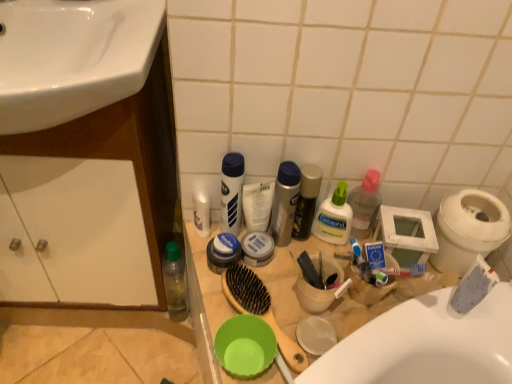
What do you see at coordinates (375, 255) in the screenshot?
I see `blue matte toothpaste at center, which is the first toothpaste from back to front` at bounding box center [375, 255].

Identify the location of brown wooden brush at center. (260, 309).

What do you see at coordinates (334, 217) in the screenshot? The height and width of the screenshot is (384, 512). I see `white pump bottle at center, which appears as the second toiletry when viewed from the right` at bounding box center [334, 217].

In order to face white matte toothpaste at right, positioned as the second toothpaste in back-to-front order, should I rotate leftwards or rightwards?

It's best to rotate right around 26.807 degrees.

Identify the location of green plastic bottle at lower left. (175, 282).

Find the location of a particular element. The width and height of the screenshot is (512, 384). white plastic canister at center, the sixth toiletry in the right-to-left sequence is located at coordinates click(232, 192).

What do you see at coordinates (364, 203) in the screenshot? The height and width of the screenshot is (384, 512). I see `translucent plastic bottle at center right, which ranks as the eighth toiletry in left-to-right order` at bounding box center [364, 203].

Locate an element on the screen. The height and width of the screenshot is (384, 512). blue matte toothpaste at center, arranged as the 1th toothpaste when viewed from the left is located at coordinates (375, 255).

Would you say white plastic canister at center, the sixth toiletry in the right-to-left sequence, is inside or outside wooden counter top at center?

white plastic canister at center, the sixth toiletry in the right-to-left sequence, lies outside wooden counter top at center.

From the image's perspective, which is above, white plastic canister at center, which is the third toiletry in left-to-right order, or wooden counter top at center?

white plastic canister at center, which is the third toiletry in left-to-right order.

Could you tell me if white plastic canister at center, the sixth toiletry in the right-to-left sequence, is turned towards wooden counter top at center?

No, white plastic canister at center, the sixth toiletry in the right-to-left sequence, is not aimed at wooden counter top at center.

Between white glossy sink at upper left and green plastic bottle at lower left, which one is positioned in front?

white glossy sink at upper left is in front.

From a real-world perspective, between white glossy sink at upper left and green plastic bottle at lower left, who is vertically lower?

In real-world perspective, green plastic bottle at lower left is lower.

Is white glossy sink at upper left not near green plastic bottle at lower left?

No.

Is white glossy sink at upper left shorter than green plastic bottle at lower left?

Correct, white glossy sink at upper left is not as tall as green plastic bottle at lower left.

Which of these two, white matte lotion at center, the 1th toiletry from the left, or shiny black bottle at center, the 6th toiletry in the left-to-right sequence, stands taller?

shiny black bottle at center, the 6th toiletry in the left-to-right sequence, is taller.

Which is less distant, (x=199, y=223) or (x=306, y=205)?

The point (x=306, y=205) is more forward.

Is white matte lotion at center, the 1th toiletry from the left, wider or thinner than shiny black bottle at center, the third toiletry when ordered from right to left?

white matte lotion at center, the 1th toiletry from the left, is thinner than shiny black bottle at center, the third toiletry when ordered from right to left.

From a real-world perspective, is white matte lotion at center, marked as the 8th toiletry in a right-to-left arrangement, above or below shiny black bottle at center, the 6th toiletry in the left-to-right sequence?

Clearly, from a real-world perspective, white matte lotion at center, marked as the 8th toiletry in a right-to-left arrangement, is below shiny black bottle at center, the 6th toiletry in the left-to-right sequence.

How much distance is there between brown wooden brush at center and translucent plastic bottle at center right, which ranks as the eighth toiletry in left-to-right order?

brown wooden brush at center is 10.81 inches from translucent plastic bottle at center right, which ranks as the eighth toiletry in left-to-right order.

Is brown wooden brush at center further to the viewer compared to translucent plastic bottle at center right, which ranks as the eighth toiletry in left-to-right order?

No, brown wooden brush at center is closer to the viewer.

Is brown wooden brush at center situated inside translucent plastic bottle at center right, which is the first toiletry in right-to-left order, or outside?

The correct answer is: outside.

Could you tell me if brown wooden brush at center is turned towards translucent plastic bottle at center right, which ranks as the eighth toiletry in left-to-right order?

No, brown wooden brush at center is not facing towards translucent plastic bottle at center right, which ranks as the eighth toiletry in left-to-right order.

Between green plastic bowl at lower center and translucent plastic bottle at center right, which is the first toiletry in right-to-left order, which one appears on the right side from the viewer's perspective?

translucent plastic bottle at center right, which is the first toiletry in right-to-left order, is more to the right.

Is the surface of green plastic bowl at lower center in direct contact with translucent plastic bottle at center right, which ranks as the eighth toiletry in left-to-right order?

No, green plastic bowl at lower center is not making contact with translucent plastic bottle at center right, which ranks as the eighth toiletry in left-to-right order.

From a real-world perspective, who is located lower, green plastic bowl at lower center or translucent plastic bottle at center right, which ranks as the eighth toiletry in left-to-right order?

green plastic bowl at lower center.

Is there a large distance between white plastic bidet at right and white matte lotion at center, marked as the 8th toiletry in a right-to-left arrangement?

They are positioned close to each other.

From the image's perspective, which one is positioned higher, white plastic bidet at right or white matte lotion at center, marked as the 8th toiletry in a right-to-left arrangement?

white matte lotion at center, marked as the 8th toiletry in a right-to-left arrangement, is shown above in the image.

Can you confirm if white plastic bidet at right is thinner than white matte lotion at center, marked as the 8th toiletry in a right-to-left arrangement?

In fact, white plastic bidet at right might be wider than white matte lotion at center, marked as the 8th toiletry in a right-to-left arrangement.

Considering the sizes of objects white glossy sink at upper left and white pump bottle at center, which appears as the second toiletry when viewed from the right, in the image provided, who is bigger, white glossy sink at upper left or white pump bottle at center, which appears as the second toiletry when viewed from the right,?

Bigger between the two is white glossy sink at upper left.

Is white glossy sink at upper left oriented away from white pump bottle at center, which is the seventh toiletry from left to right?

white glossy sink at upper left does not have its back to white pump bottle at center, which is the seventh toiletry from left to right.

Is white glossy sink at upper left far from white pump bottle at center, which is the seventh toiletry from left to right?

They are positioned close to each other.

Can you confirm if white glossy sink at upper left is positioned to the left of white pump bottle at center, which appears as the second toiletry when viewed from the right?

Yes.

At what (x,y) coordinates should I click in order to perform the action: click on the 7th toiletry above the wooden counter top at center (from a real-world perspective). Please return your answer as a coordinate pair (x, y). The width and height of the screenshot is (512, 384). Looking at the image, I should click on (232, 192).

Locate an element on the screen. The image size is (512, 384). bottle below the white glossy sink at upper left (from the image's perspective) is located at coordinates (175, 282).

When comparing their distances from white pump bottle at center, which appears as the second toiletry when viewed from the right, does white matte toothpaste at right, positioned as the second toothpaste in back-to-front order, or green plastic bottle at lower left seem closer?

Based on the image, white matte toothpaste at right, positioned as the second toothpaste in back-to-front order, appears to be nearer to white pump bottle at center, which appears as the second toiletry when viewed from the right.

Consider the image. From the image, which object appears to be nearer to blue matte toothpaste at center, the 2th toothpaste from the front, brown wooden brush at center or silver metallic can at center, the fourth toiletry in the right-to-left sequence?

silver metallic can at center, the fourth toiletry in the right-to-left sequence.

When comparing their distances from green plastic bowl at lower center, does white glossy sink at upper left or white plastic bidet at right seem closer?

The object closer to green plastic bowl at lower center is white plastic bidet at right.

Estimate the real-world distances between objects in this image. Which object is further from green plastic bowl at lower center, wooden counter top at center or matte white cream container at center, which is the 5th toiletry in right-to-left order?

matte white cream container at center, which is the 5th toiletry in right-to-left order, is further to green plastic bowl at lower center.

From the image, which object appears to be nearer to wooden counter top at center, green plastic bowl at lower center or translucent plastic bottle at center right, which ranks as the eighth toiletry in left-to-right order?

The object closer to wooden counter top at center is green plastic bowl at lower center.

Looking at the image, which one is located further to white glossy sink at upper left, white pump bottle at center, which appears as the second toiletry when viewed from the right, or shiny black bottle at center, the third toiletry when ordered from right to left?

→ white pump bottle at center, which appears as the second toiletry when viewed from the right.

When comparing their distances from green plastic bottle at lower left, does white pump bottle at center, which appears as the second toiletry when viewed from the right, or white plastic canister at center, the sixth toiletry in the right-to-left sequence, seem further?

white pump bottle at center, which appears as the second toiletry when viewed from the right, is further to green plastic bottle at lower left.

Considering their positions, is shiny black bottle at center, the third toiletry when ordered from right to left, positioned closer to green plastic bowl at lower center than white plastic bidet at right?

Based on the image, shiny black bottle at center, the third toiletry when ordered from right to left, appears to be nearer to green plastic bowl at lower center.

I want to click on toothpaste between shiny black bottle at center, the 6th toiletry in the left-to-right sequence, and translucent plastic bottle at center right, which is the first toiletry in right-to-left order, in the horizontal direction, so click(375, 255).

Identify the location of toothpaste between green plastic bottle at lower left and translucent plastic bottle at center right, which ranks as the eighth toiletry in left-to-right order. (375, 255).

Image resolution: width=512 pixels, height=384 pixels. Identify the location of brush between white plastic canister at center, the sixth toiletry in the right-to-left sequence, and wooden counter top at center in the up-down direction. (260, 309).

Find the location of a particular element. toothpaste that lies between blue matte toothpaste at center, the 2th toothpaste from the front, and wooden counter top at center from top to bottom is located at coordinates (473, 286).